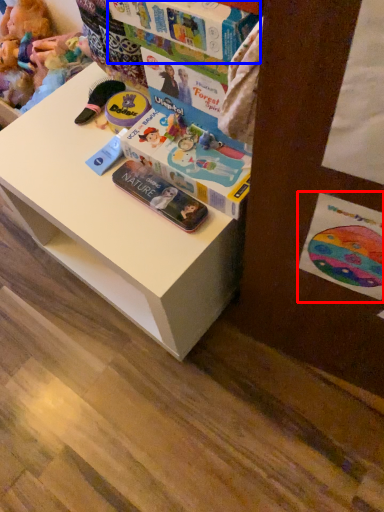
Question: Which object is closer to the camera taking this photo, postcard (highlighted by a red box) or book (highlighted by a blue box)?

Choices:
 (A) postcard
 (B) book

Answer: (A)